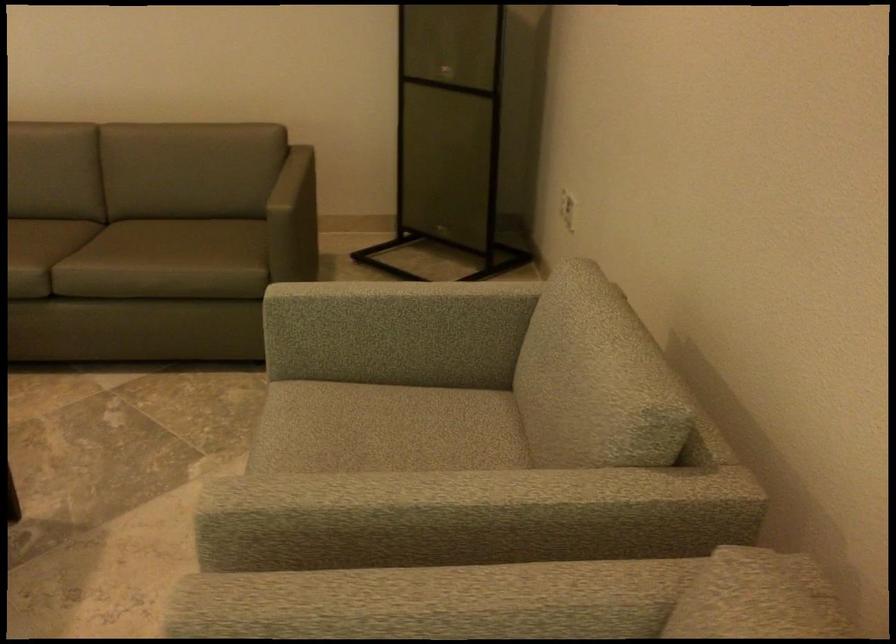
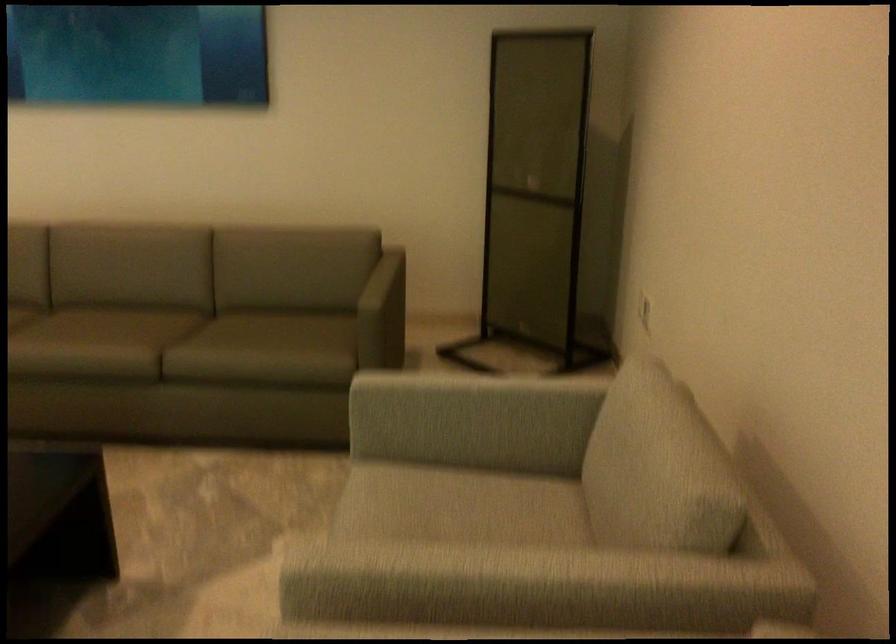
Where in the second image is the point corresponding to (x=383, y=409) from the first image?

(455, 491)